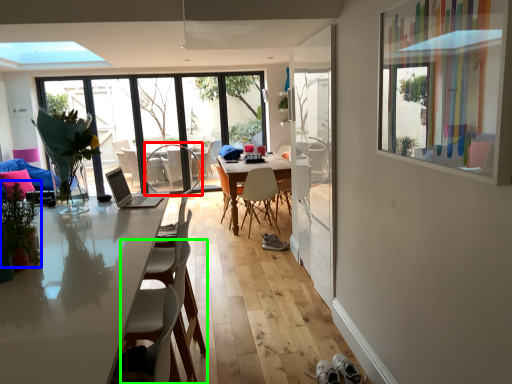
Question: Based on their relative distances, which object is nearer to armchair (highlighted by a red box)? Choose from plant (highlighted by a blue box) and chair (highlighted by a green box).

Choices:
 (A) plant
 (B) chair

Answer: (B)